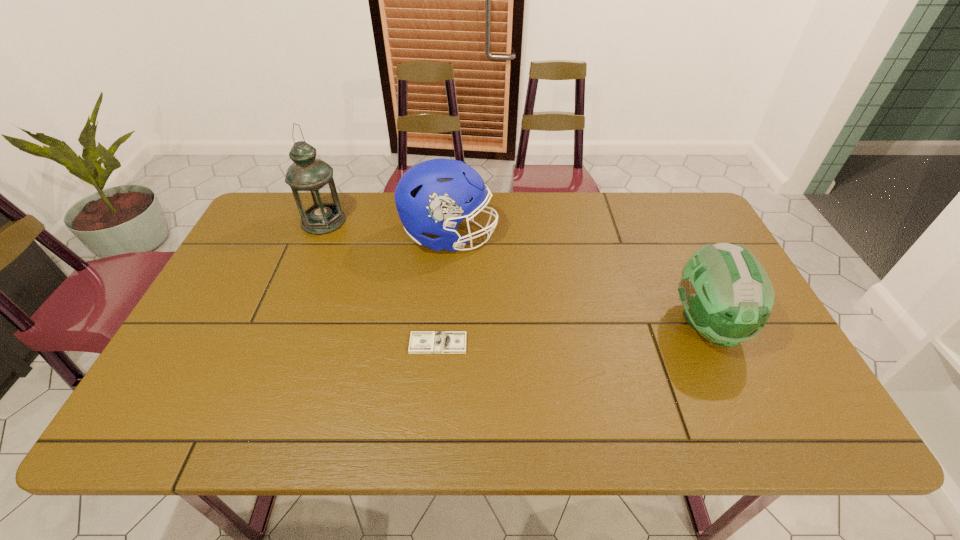
At what (x,y) coordinates should I click in order to perform the action: click on vacant area that lies between the second shortest object and the shortest object. Please return your answer as a coordinate pair (x, y). This screenshot has width=960, height=540. Looking at the image, I should click on (572, 334).

The image size is (960, 540). What are the coordinates of `free space between the leftmost object and the third tallest object` in the screenshot? It's located at (515, 273).

Where is `empty location between the shortest object and the leftmost object`? empty location between the shortest object and the leftmost object is located at coordinates (381, 282).

Where is `vacant area between the right football helmet and the farther football helmet`? Image resolution: width=960 pixels, height=540 pixels. vacant area between the right football helmet and the farther football helmet is located at coordinates (578, 280).

The height and width of the screenshot is (540, 960). What are the coordinates of `vacant point located between the dollar and the farther football helmet` in the screenshot? It's located at (444, 290).

Where is `vacant space in between the oil lamp and the left football helmet`? vacant space in between the oil lamp and the left football helmet is located at coordinates (387, 229).

Where is `free space between the oil lamp and the second shortest object`? Image resolution: width=960 pixels, height=540 pixels. free space between the oil lamp and the second shortest object is located at coordinates (515, 273).

Find the location of a particular element. Image resolution: width=960 pixels, height=540 pixels. empty space between the dollar and the left football helmet is located at coordinates (444, 290).

I want to click on unoccupied position between the dollar and the left football helmet, so click(x=444, y=290).

Image resolution: width=960 pixels, height=540 pixels. I want to click on object that is the nearest to the shortest object, so click(433, 196).